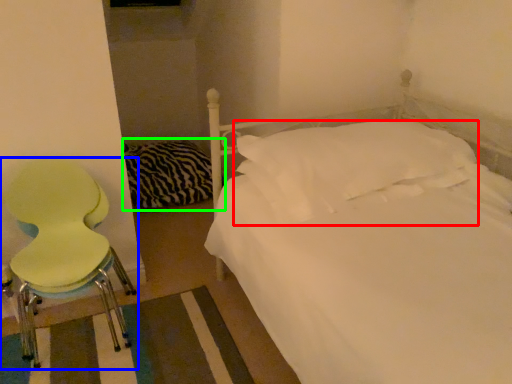
Question: Which object is the farthest from pillow (highlighted by a red box)? Choose among these: chair (highlighted by a blue box) or bedding (highlighted by a green box).

Choices:
 (A) chair
 (B) bedding

Answer: (B)